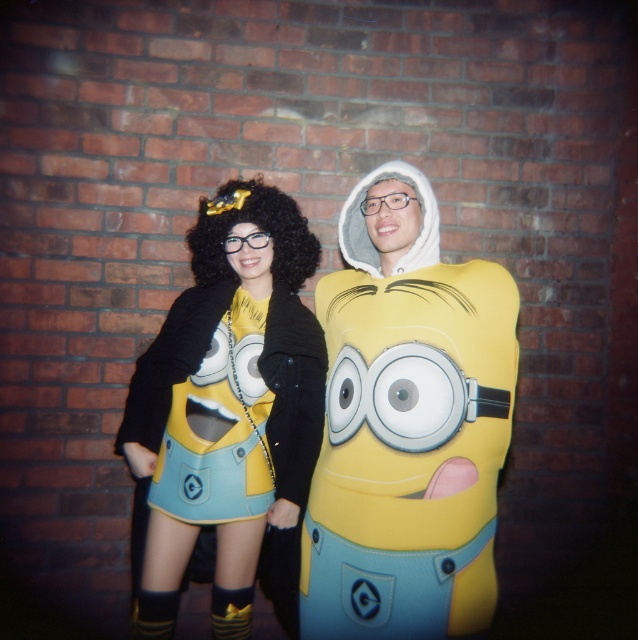
Based on the photo, you are a photographer setting up for a group photo. You need to position the matte yellow costume at center so that it aligns with the center of the frame. Currently, it is at coordinates point 0.664, 0.639. Is it already centered?

The matte yellow costume at center is located at point (406,424), which means it is not perfectly centered. To center it, adjust its position to coordinates closer to (319,320).

You are a photographer trying to capture a photo of the two Minion characters. The matte yellow costume at center is represented by point (x=406, y=424). Where should you position your camera to ensure both characters are in frame?

The matte yellow costume at center is located at point (x=406, y=424), so positioning the camera centrally would ensure both characters are in frame.

You are a costume designer who needs to choose between two Minion costumes for a stage performance. The stage has a narrow walkway that can only accommodate costumes up to 1 meter in width. Given the descriptions of the matte yellow costume at center and the matte yellow dress at center, which costume would you recommend to ensure it fits through the walkway?

The matte yellow costume at center has a lesser width compared to the matte yellow dress at center, so the matte yellow costume at center would be the better choice as it is narrower and more likely to fit through the 1 meter wide walkway.